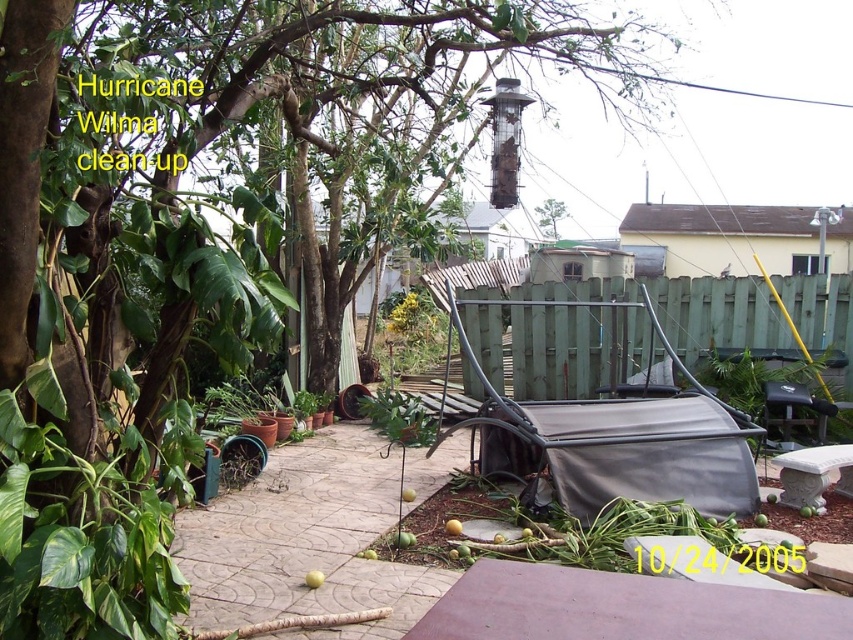
Is point (535, 337) in front of point (558, 214)?

Yes, point (535, 337) is closer to viewer.

From the picture: Can you confirm if green wood fence at center is bigger than green leafy tree at upper center?

Yes, green wood fence at center is bigger than green leafy tree at upper center.

Is point (561, 390) less distant than point (561, 209)?

Yes.

Image resolution: width=853 pixels, height=640 pixels. I want to click on green wood fence at center, so click(554, 336).